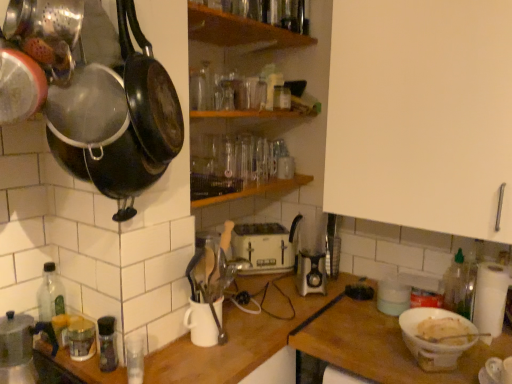
Question: In the image, is white plastic toaster at center positioned in front of or behind white matte bowl at lower right, the 1th table viewed from the right?

Choices:
 (A) front
 (B) behind

Answer: (B)

Question: From their relative heights in the image, would you say white plastic toaster at center is taller or shorter than white matte bowl at lower right, the 1th table viewed from the right?

Choices:
 (A) short
 (B) tall

Answer: (A)

Question: Which object is positioned closest to the black matte frying pan at upper left, which is the 1th frying pan from right to left?

Choices:
 (A) metallic black frying pan at upper left, positioned as the 1th frying pan in left-to-right order
 (B) wooden shelf at center, which ranks as the 1th shelf in bottom-to-top order
 (C) green plastic bottle at right, the 4th bottle positioned from the front
 (D) white matte bowl at lower right
 (E) clear glass bottle at lower left, acting as the 3th bottle starting from the left

Answer: (A)

Question: Considering the real-world distances, which object is farthest from the clear glass bottle at lower left, which is the 1th bottle from left to right?

Choices:
 (A) white matte bowl at lower right, the 1th table viewed from the right
 (B) wooden cutting board at center, the second table in the right-to-left sequence
 (C) white matte cabinet at upper right
 (D) white plastic toaster at center
 (E) wooden shelf at center, which ranks as the 1th shelf in bottom-to-top order

Answer: (C)